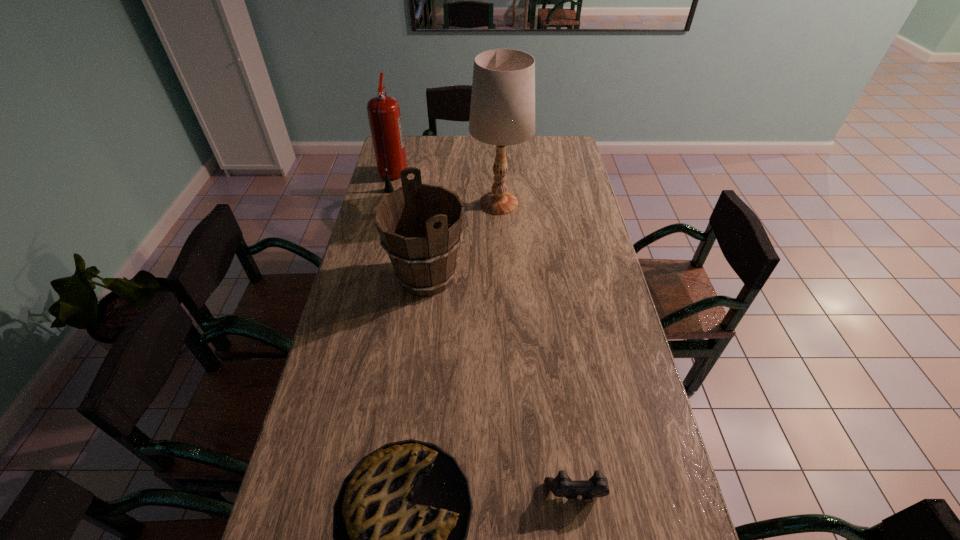
Locate an element on the screen. bucket that is at the left edge is located at coordinates (420, 225).

Locate an element on the screen. The height and width of the screenshot is (540, 960). object at the right edge is located at coordinates 561,486.

In order to click on free space at the far edge in this screenshot , I will do `click(424, 136)`.

The height and width of the screenshot is (540, 960). In the image, there is a desktop. What are the coordinates of `vacant region at the left edge` in the screenshot? It's located at (294, 529).

What are the coordinates of `free region at the right edge of the desktop` in the screenshot? It's located at (562, 199).

This screenshot has width=960, height=540. I want to click on vacant position at the far right corner of the desktop, so click(x=552, y=148).

At what (x,y) coordinates should I click in order to perform the action: click on vacant area that lies between the control and the bucket. Please return your answer as a coordinate pair (x, y). Image resolution: width=960 pixels, height=540 pixels. Looking at the image, I should click on (501, 385).

Locate an element on the screen. free space between the bucket and the tallest object is located at coordinates (463, 240).

Where is `empty space that is in between the third tallest object and the tallest object`? This screenshot has height=540, width=960. empty space that is in between the third tallest object and the tallest object is located at coordinates (463, 240).

At what (x,y) coordinates should I click in order to perform the action: click on free space between the third shortest object and the tallest object. Please return your answer as a coordinate pair (x, y). This screenshot has height=540, width=960. Looking at the image, I should click on (463, 240).